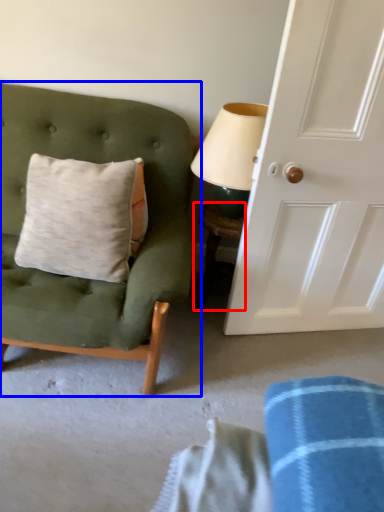
Question: Among these objects, which one is nearest to the camera, table (highlighted by a red box) or chair (highlighted by a blue box)?

Choices:
 (A) table
 (B) chair

Answer: (B)